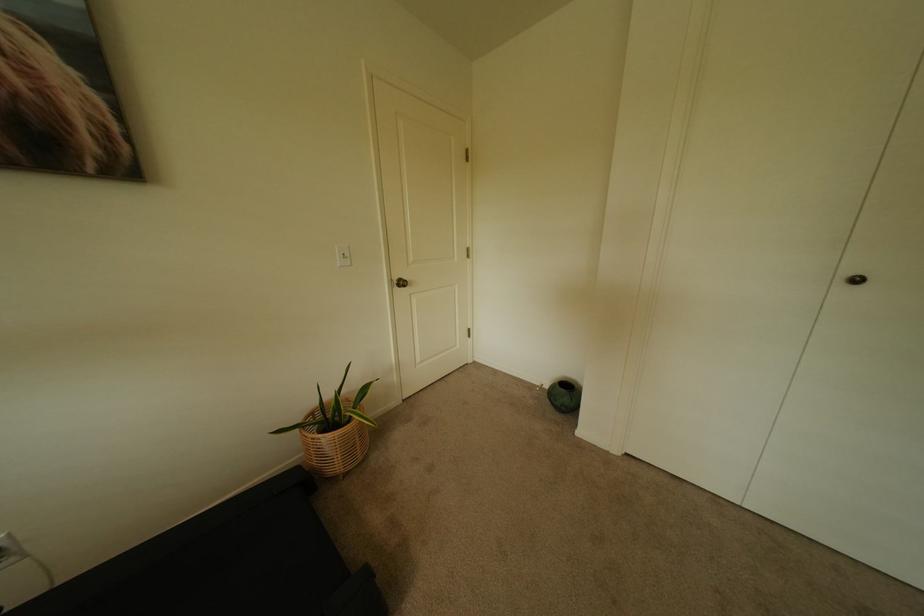
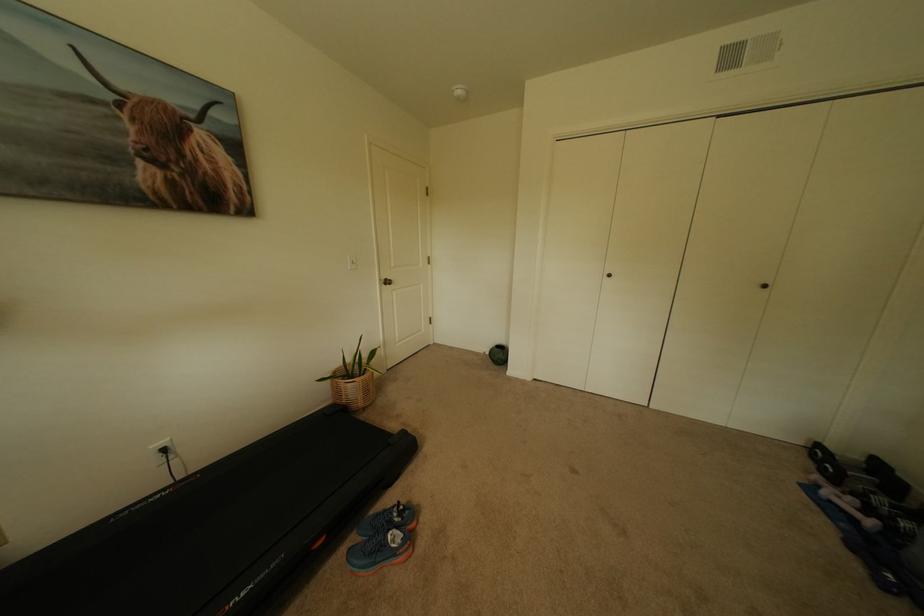
Which direction would the cameraman need to move to produce the second image?

The movement direction of the cameraman is left, backward.